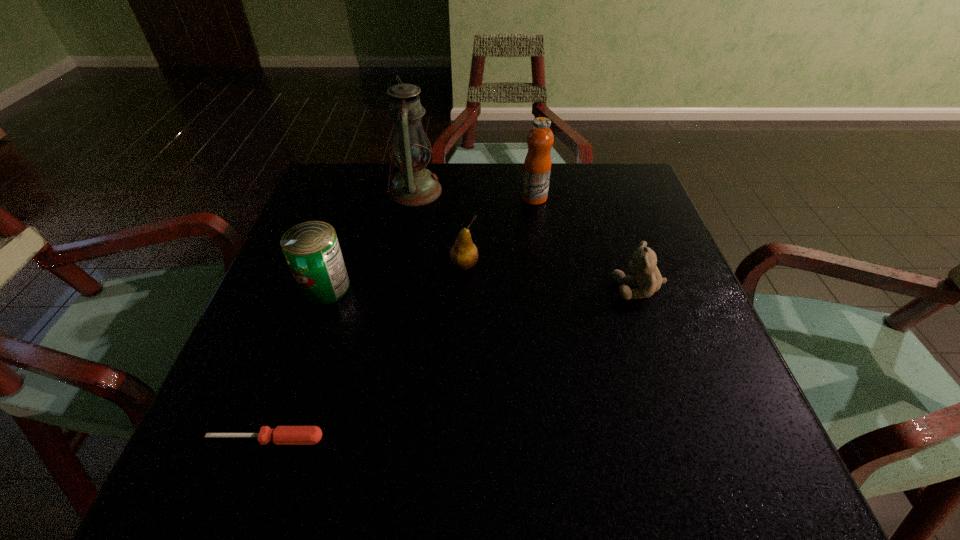
The height and width of the screenshot is (540, 960). I want to click on the third object from left to right, so click(x=414, y=185).

This screenshot has width=960, height=540. I want to click on the tallest object, so [x=414, y=185].

Find the location of `the second tallest object`. the second tallest object is located at coordinates (537, 166).

Identify the location of the fifth object from left to right. (537, 166).

Identify the location of can. The width and height of the screenshot is (960, 540). (312, 251).

Where is `pear`? The height and width of the screenshot is (540, 960). pear is located at coordinates (464, 254).

You are a GUI agent. You are given a task and a screenshot of the screen. Output one action in this format:
    pyautogui.click(x=<x>, y=<y>)
    Task: Click on the fifth tallest object
    Image resolution: width=960 pixels, height=540 pixels.
    Given the screenshot: What is the action you would take?
    pyautogui.click(x=643, y=262)

Image resolution: width=960 pixels, height=540 pixels. What are the coordinates of `the rightmost object` in the screenshot? It's located at (643, 262).

Image resolution: width=960 pixels, height=540 pixels. Identify the location of screwdriver. (282, 435).

In order to click on the nearest object in this screenshot , I will do `click(282, 435)`.